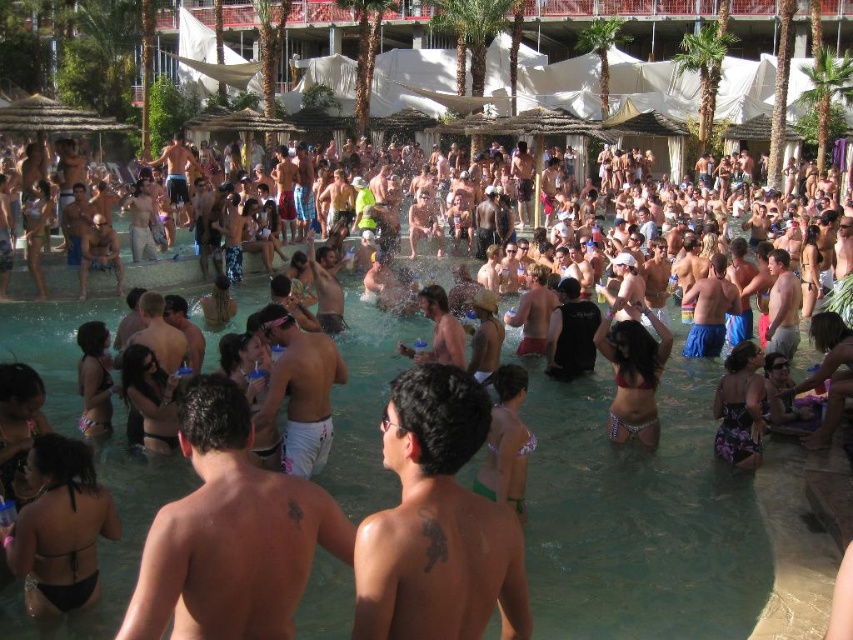
Question: Is dark skin tattooed back at center smaller than dark bikini at center?

Choices:
 (A) no
 (B) yes

Answer: (A)

Question: Which point is closer to the camera?

Choices:
 (A) (88, 563)
 (B) (370, 561)
 (C) (723, 410)

Answer: (B)

Question: Which point is farther to the camera?

Choices:
 (A) (451, 378)
 (B) (271, 406)
 (C) (216, 465)
 (D) (431, 285)

Answer: (D)

Question: Observing the image, what is the correct spatial positioning of white cotton shorts at center in reference to floral print bikini bottom at center?

Choices:
 (A) above
 (B) below

Answer: (A)

Question: Which point is farther from the camera taking this photo?

Choices:
 (A) (616, 328)
 (B) (263, 401)
 (C) (289, 604)
 (D) (454, 337)

Answer: (D)

Question: Can you confirm if smooth white shorts at center is bigger than white cotton shorts at center?

Choices:
 (A) yes
 (B) no

Answer: (A)